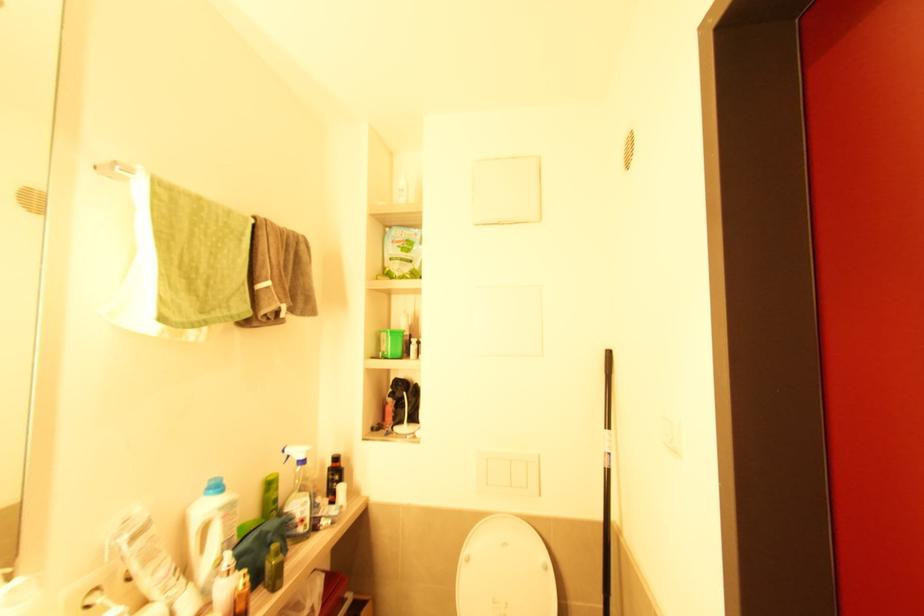
Identify the location of white toilet lid. (505, 570).